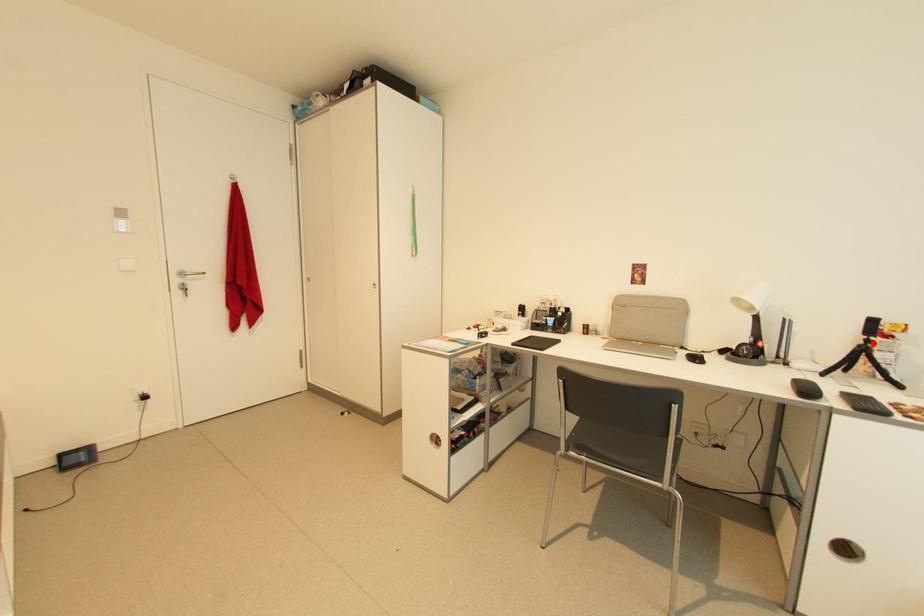
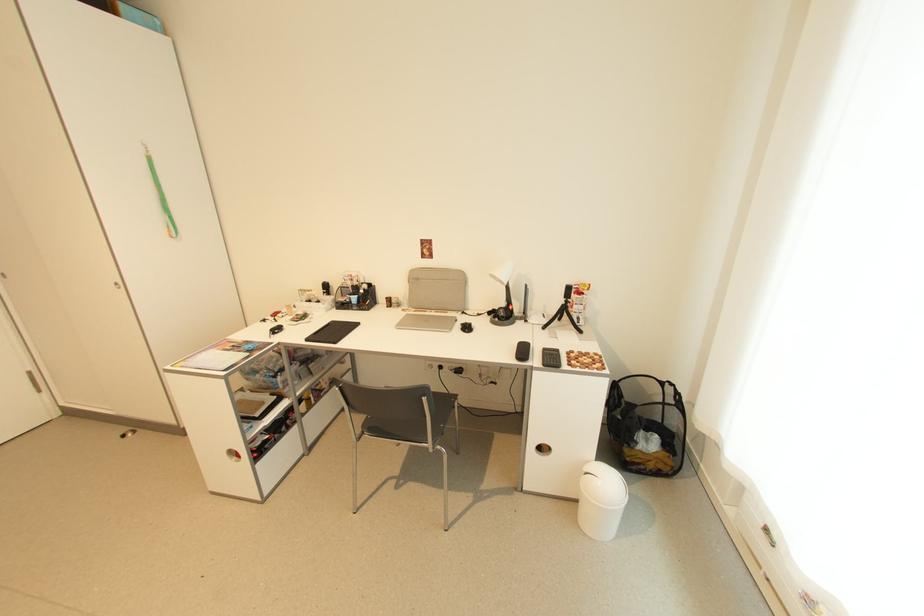
Find the pixel in the second image that matches the highlighted location in the first image.

(572, 302)